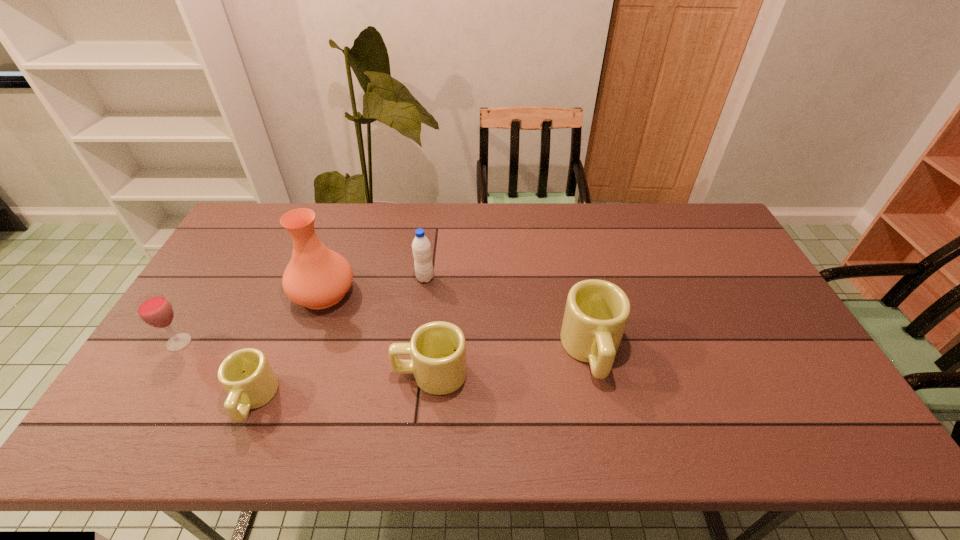
You are a GUI agent. You are given a task and a screenshot of the screen. Output one action in this format:
    pyautogui.click(x=<x>, y=<y>)
    Task: Click on the free space located 0.300m with the handle on the side of the second tallest mug
    
    Given the screenshot: What is the action you would take?
    (x=276, y=374)

Identify the location of free space located with the handle on the side of the second tallest mug. (331, 374).

Find the location of a particular element. vacant space located 0.330m on the back of the leftmost object is located at coordinates (233, 254).

Image resolution: width=960 pixels, height=540 pixels. Identify the location of free space located 0.220m on the front of the tallest object. (291, 384).

You are a GUI agent. You are given a task and a screenshot of the screen. Output one action in this format:
    pyautogui.click(x=<x>, y=<y>)
    Task: Click on the free space located on the back of the water bottle
    
    Given the screenshot: What is the action you would take?
    pyautogui.click(x=431, y=234)

This screenshot has width=960, height=540. Find the location of `object that is at the left edge`. object that is at the left edge is located at coordinates (155, 310).

This screenshot has height=540, width=960. In the image, there is a desktop. What are the coordinates of `blank space at the far edge` in the screenshot? It's located at point(482,224).

Where is `blank area at the left edge`? This screenshot has height=540, width=960. blank area at the left edge is located at coordinates (253, 255).

You are a GUI agent. You are given a task and a screenshot of the screen. Output one action in this format:
    pyautogui.click(x=<x>, y=<y>)
    Task: Click on the vacant position at the right edge of the desktop
    
    Given the screenshot: What is the action you would take?
    761,296

In the image, there is a desktop. Identify the location of vacant space at the far left corner. The width and height of the screenshot is (960, 540). (265, 216).